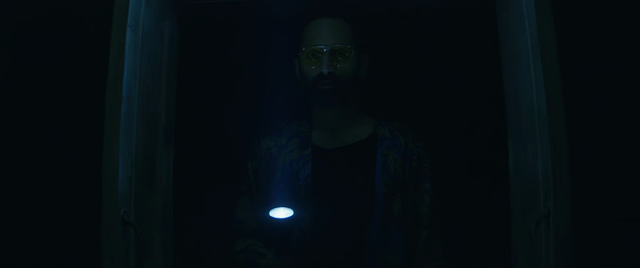
Locate an element on the screen. door is located at coordinates (148, 128).